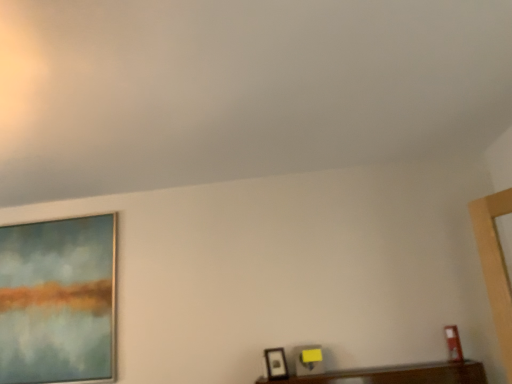
Question: Should I look upward or downward to see matte glass painting at left, acting as the third picture frame starting from the right?

Choices:
 (A) down
 (B) up

Answer: (A)

Question: Is matte black picture frame at lower right, the 3th picture frame positioned from the back, positioned beyond the bounds of matte black picture frame at lower center, positioned as the second picture frame in left-to-right order?

Choices:
 (A) no
 (B) yes

Answer: (B)

Question: Is matte black picture frame at lower right, which is counted as the third picture frame, starting from the left, smaller than matte black picture frame at lower center, the second picture frame from the right?

Choices:
 (A) no
 (B) yes

Answer: (B)

Question: From a real-world perspective, is matte black picture frame at lower right, the 3th picture frame positioned from the back, on top of matte black picture frame at lower center, the second picture frame from the right?

Choices:
 (A) no
 (B) yes

Answer: (B)

Question: Does matte black picture frame at lower right, the 1th picture frame from the right, appear on the left side of matte black picture frame at lower center, arranged as the 2th picture frame when viewed from the back?

Choices:
 (A) no
 (B) yes

Answer: (A)

Question: Is matte black picture frame at lower right, the 1th picture frame positioned from the front, further to the viewer compared to matte black picture frame at lower center, the second picture frame positioned from the front?

Choices:
 (A) yes
 (B) no

Answer: (B)

Question: Does matte black picture frame at lower right, which is counted as the third picture frame, starting from the left, have a greater height compared to matte black picture frame at lower center, positioned as the second picture frame in left-to-right order?

Choices:
 (A) no
 (B) yes

Answer: (B)

Question: Is matte black picture frame at lower right, the 1th picture frame from the right, completely or partially outside of matte glass painting at left, positioned as the first picture frame in left-to-right order?

Choices:
 (A) yes
 (B) no

Answer: (A)

Question: Is matte black picture frame at lower right, which is counted as the third picture frame, starting from the left, facing towards matte glass painting at left, which is counted as the 3th picture frame, starting from the front?

Choices:
 (A) yes
 (B) no

Answer: (B)

Question: Is matte black picture frame at lower right, the 1th picture frame positioned from the front, positioned in front of matte glass painting at left, positioned as the first picture frame in left-to-right order?

Choices:
 (A) no
 (B) yes

Answer: (B)

Question: Is matte black picture frame at lower right, the 1th picture frame positioned from the front, oriented away from matte glass painting at left, positioned as the first picture frame in left-to-right order?

Choices:
 (A) no
 (B) yes

Answer: (A)

Question: Is matte black picture frame at lower right, the 3th picture frame positioned from the back, to the left of matte glass painting at left, acting as the third picture frame starting from the right, from the viewer's perspective?

Choices:
 (A) no
 (B) yes

Answer: (A)

Question: Is matte black picture frame at lower right, the 1th picture frame from the right, bigger than matte glass painting at left, which is the 1th picture frame from back to front?

Choices:
 (A) no
 (B) yes

Answer: (A)

Question: Is matte black picture frame at lower center, positioned as the second picture frame in left-to-right order, at the right side of matte glass painting at left, which is counted as the 3th picture frame, starting from the front?

Choices:
 (A) yes
 (B) no

Answer: (A)